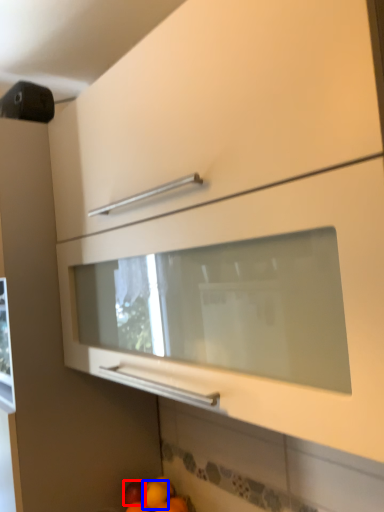
Question: Which object is further to the camera taking this photo, apple (highlighted by a red box) or orange (highlighted by a blue box)?

Choices:
 (A) apple
 (B) orange

Answer: (A)